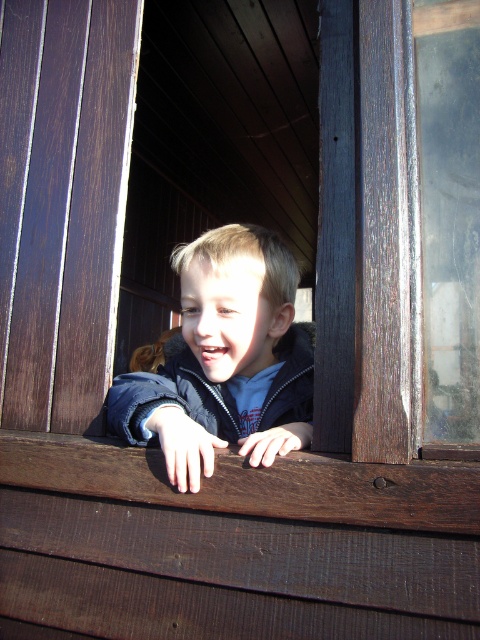
You are a photographer trying to capture the child peeking from behind the wooden structure. You want to position your camera such that the transparent glass window at right is visible in the background. Is the point at coordinates (x=447, y=212) on the wooden structure or the transparent glass window at right?

The point at coordinates (x=447, y=212) is on the transparent glass window at right.

You are a fashion designer looking at the image. You need to determine which clothing item, the matte blue jacket at center or the blue fleece sweatshirt at center, is narrower in width. Which one is narrower?

The matte blue jacket at center is narrower in width compared to the blue fleece sweatshirt at center, as stated in the description that the matte blue jacket at center has a smaller width.

You are standing in front of the wooden structure where the child is hiding. You want to hand them a toy that is 0.5 meters long. Will the toy fit in the space between you and the matte blue jacket at center?

The matte blue jacket at center is 1.06 meters from the viewer. Since the toy is 0.5 meters long, it will fit in the space between you and the matte blue jacket at center as the distance is greater than the toy length.